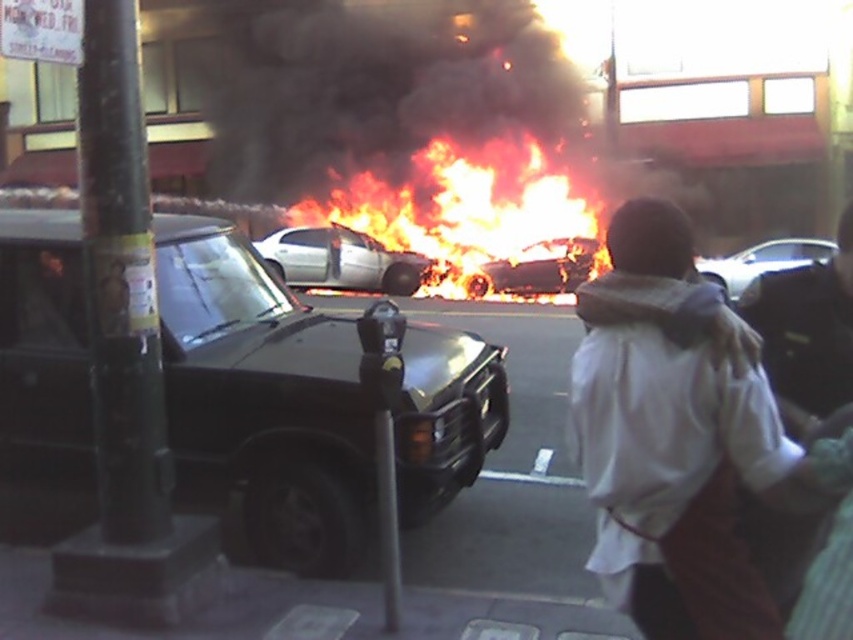
Who is positioned more to the right, shiny black jeep at left or flaming car at center?

shiny black jeep at left

Measure the distance between point (195, 381) and camera.

They are 16.54 feet apart.

Image resolution: width=853 pixels, height=640 pixels. In order to click on shiny black jeep at left in this screenshot , I will do point(263,397).

Can you confirm if charred metal car at center is positioned to the right of shiny silver sedan at right?

In fact, charred metal car at center is to the left of shiny silver sedan at right.

Is charred metal car at center above shiny silver sedan at right?

Yes.

Who is more distant from viewer, [515,262] or [740,280]?

The point [515,262] is more distant.

Locate an element on the screen. This screenshot has height=640, width=853. charred metal car at center is located at coordinates (537, 268).

Who is more distant from viewer, (396, 506) or (515, 259)?

The point (515, 259) is more distant.

From the picture: Who is lower down, metallic gray parking meter at center or charred metal car at center?

metallic gray parking meter at center

Is point (387, 609) more distant than point (585, 260)?

No, it is in front of (585, 260).

The image size is (853, 640). I want to click on metallic gray parking meter at center, so click(x=384, y=433).